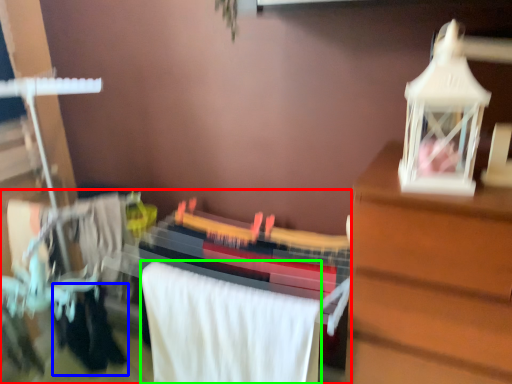
Question: Which object is the closest to the closet (highlighted by a red box)? Choose among these: clothing (highlighted by a blue box) or bath towel (highlighted by a green box).

Choices:
 (A) clothing
 (B) bath towel

Answer: (B)